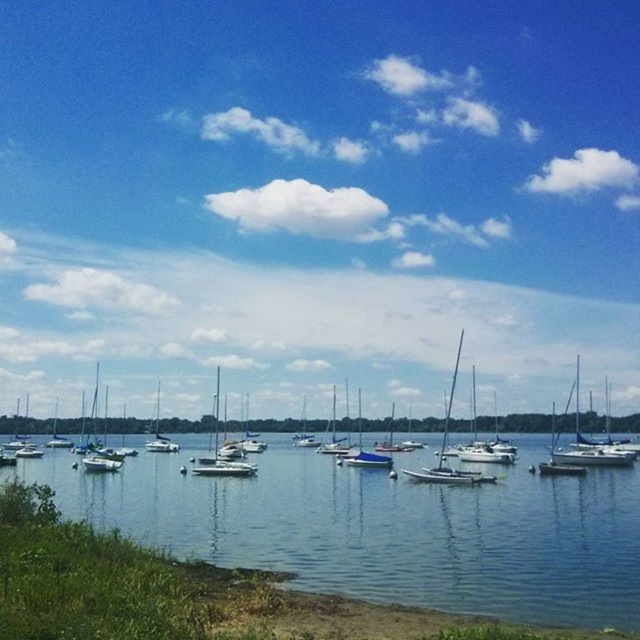
Question: Which point is closer to the camera?

Choices:
 (A) white matte sailboat at lower left
 (B) clear blue water at lower center

Answer: (B)

Question: Does clear blue water at lower center come in front of white sailboat at right?

Choices:
 (A) no
 (B) yes

Answer: (B)

Question: Which point is farther from the camera taking this photo?

Choices:
 (A) tap(468, 529)
 (B) tap(99, 454)

Answer: (B)

Question: Does white sailboat at right appear on the left side of white matte sailboat at lower left?

Choices:
 (A) yes
 (B) no

Answer: (B)

Question: Is white matte sailboat at left positioned at the back of white matte sailboat at lower left?

Choices:
 (A) no
 (B) yes

Answer: (A)

Question: Estimate the real-world distances between objects in this image. Which object is closer to the white sailboat at right?

Choices:
 (A) clear blue water at lower center
 (B) white matte sailboat at lower left
 (C) white matte sailboat at left

Answer: (A)